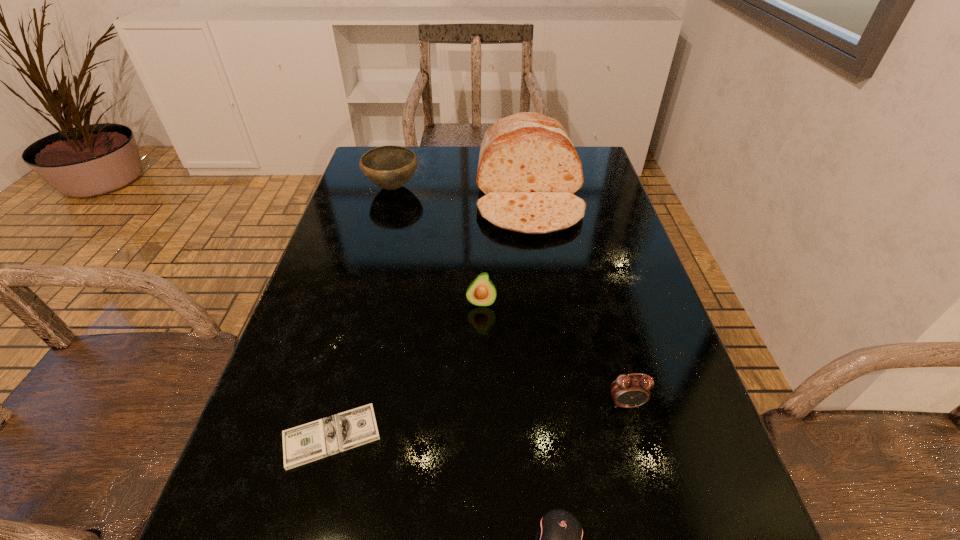
Where is `bread that is at the far edge`? bread that is at the far edge is located at coordinates (528, 170).

The image size is (960, 540). Identify the location of bowl at the far edge. (389, 167).

Image resolution: width=960 pixels, height=540 pixels. In order to click on bowl that is at the left edge in this screenshot , I will do `click(389, 167)`.

I want to click on dollar that is at the left edge, so click(x=340, y=432).

Identify the location of bread that is at the right edge. This screenshot has width=960, height=540. (528, 170).

Find the location of `alarm clock that is at the right edge`. alarm clock that is at the right edge is located at coordinates (628, 391).

Find the location of a particular element. The height and width of the screenshot is (540, 960). object that is at the far left corner is located at coordinates (389, 167).

In order to click on object situated at the far right corner in this screenshot , I will do `click(528, 170)`.

I want to click on free space at the far edge, so click(439, 159).

At what (x,y) coordinates should I click in order to perform the action: click on free space at the left edge of the desktop. Please return your answer as a coordinate pair (x, y). The width and height of the screenshot is (960, 540). Looking at the image, I should click on (362, 374).